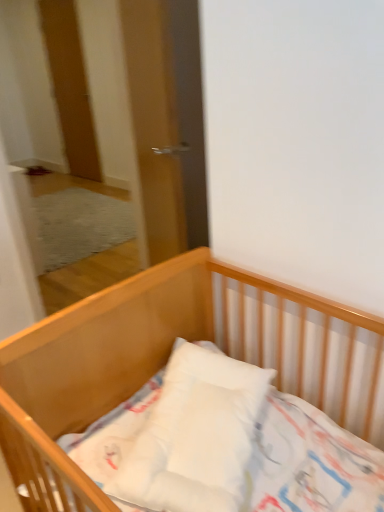
Question: Considering the positions of wooden door at upper left and transparent glass door at center in the image, is wooden door at upper left bigger or smaller than transparent glass door at center?

Choices:
 (A) small
 (B) big

Answer: (A)

Question: In terms of width, does wooden door at upper left look wider or thinner when compared to transparent glass door at center?

Choices:
 (A) thin
 (B) wide

Answer: (A)

Question: Which is farther from the wooden door at upper left?

Choices:
 (A) transparent glass door at center
 (B) wooden crib at center

Answer: (B)

Question: Considering the real-world distances, which object is closest to the wooden door at upper left?

Choices:
 (A) wooden crib at center
 (B) transparent glass door at center

Answer: (B)